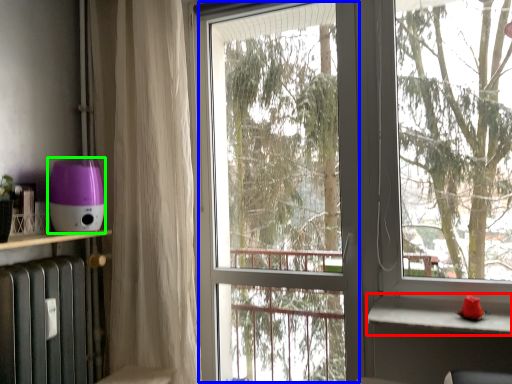
Question: Based on their relative distances, which object is farther from window sill (highlighted by a red box)? Choose from screen door (highlighted by a blue box) and appliance (highlighted by a green box).

Choices:
 (A) screen door
 (B) appliance

Answer: (A)